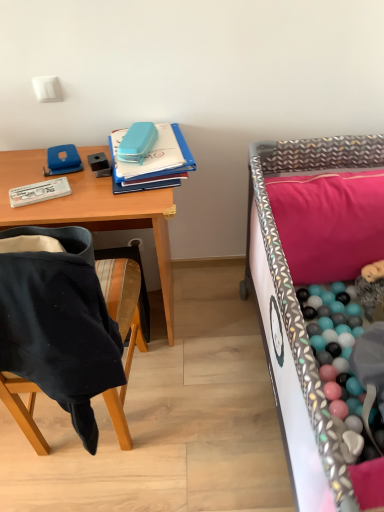
Question: Can you confirm if black fabric chair at left is positioned to the right of wooden desk at upper left?

Choices:
 (A) no
 (B) yes

Answer: (B)

Question: Is black fabric chair at left positioned with its back to wooden desk at upper left?

Choices:
 (A) no
 (B) yes

Answer: (A)

Question: Can you confirm if black fabric chair at left is smaller than wooden desk at upper left?

Choices:
 (A) yes
 (B) no

Answer: (A)

Question: Considering the relative sizes of black fabric chair at left and wooden desk at upper left in the image provided, is black fabric chair at left taller than wooden desk at upper left?

Choices:
 (A) no
 (B) yes

Answer: (A)

Question: Is the position of black fabric chair at left more distant than that of wooden desk at upper left?

Choices:
 (A) no
 (B) yes

Answer: (A)

Question: From the image's perspective, is black fabric chair at left beneath wooden desk at upper left?

Choices:
 (A) yes
 (B) no

Answer: (A)

Question: Can you confirm if pink fabric pillow at upper right is thinner than black fabric chair at left?

Choices:
 (A) yes
 (B) no

Answer: (B)

Question: From a real-world perspective, is pink fabric pillow at upper right under black fabric chair at left?

Choices:
 (A) yes
 (B) no

Answer: (A)

Question: Considering the relative positions of pink fabric pillow at upper right and black fabric chair at left in the image provided, is pink fabric pillow at upper right to the right of black fabric chair at left from the viewer's perspective?

Choices:
 (A) yes
 (B) no

Answer: (A)

Question: Does pink fabric pillow at upper right have a greater height compared to black fabric chair at left?

Choices:
 (A) yes
 (B) no

Answer: (B)

Question: Is the depth of pink fabric pillow at upper right greater than that of black fabric chair at left?

Choices:
 (A) yes
 (B) no

Answer: (A)

Question: Could you tell me if pink fabric pillow at upper right is facing black fabric chair at left?

Choices:
 (A) no
 (B) yes

Answer: (A)

Question: Is pink fabric pillow at upper right located outside patterned fabric infant bed at right?

Choices:
 (A) no
 (B) yes

Answer: (A)